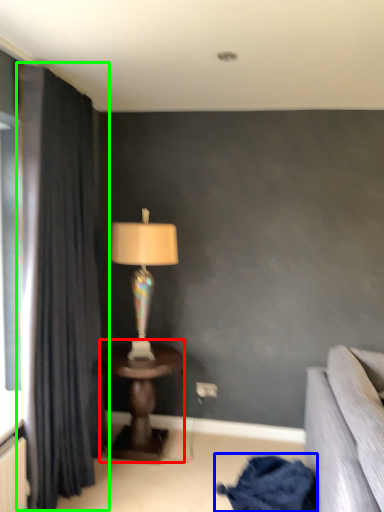
Question: Which object is the closest to the table (highlighted by a red box)? Choose among these: blanket (highlighted by a blue box) or curtain (highlighted by a green box).

Choices:
 (A) blanket
 (B) curtain

Answer: (B)